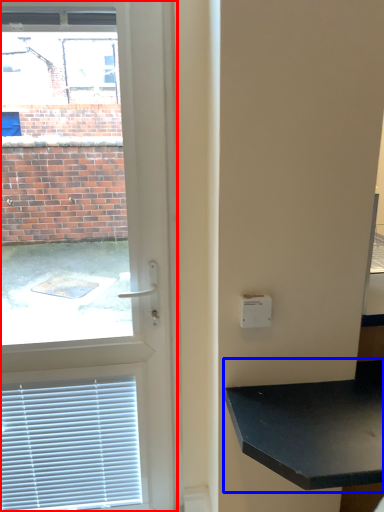
Question: Which object is closer to the camera taking this photo, door (highlighted by a red box) or table (highlighted by a blue box)?

Choices:
 (A) door
 (B) table

Answer: (B)